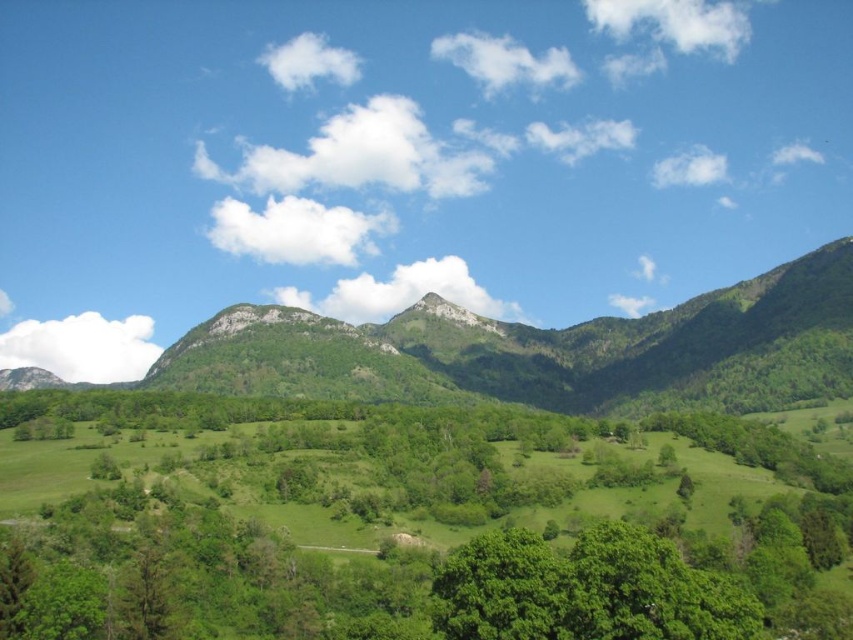
Question: Which object appears closest to the camera in this image?

Choices:
 (A) green leafy mountain at center
 (B) green leafy tree at center

Answer: (B)

Question: Can you confirm if green leafy tree at center is thinner than green leafy mountain at center?

Choices:
 (A) yes
 (B) no

Answer: (A)

Question: Which object is closer to the camera taking this photo?

Choices:
 (A) green leafy mountain at center
 (B) green leafy tree at center

Answer: (B)

Question: From the image, what is the correct spatial relationship of green leafy tree at center in relation to green leafy mountain at center?

Choices:
 (A) right
 (B) left

Answer: (A)

Question: Observing the image, what is the correct spatial positioning of green leafy tree at center in reference to green leafy mountain at center?

Choices:
 (A) above
 (B) below

Answer: (B)